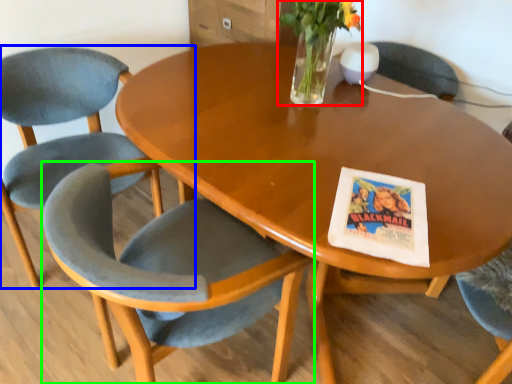
Question: Based on their relative distances, which object is nearer to floral arrangement (highlighted by a red box)? Choose from chair (highlighted by a blue box) and chair (highlighted by a green box).

Choices:
 (A) chair
 (B) chair

Answer: (B)